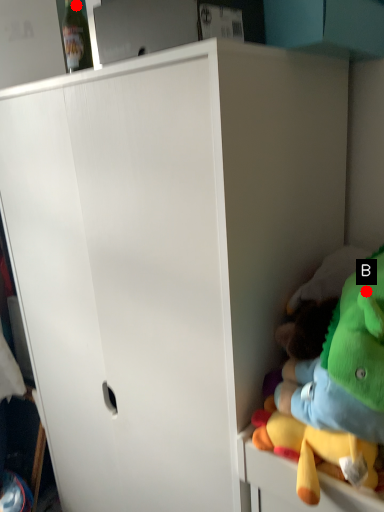
Question: Two points are circled on the image, labeled by A and B beside each circle. Which point is farther to the camera?

Choices:
 (A) A is further
 (B) B is further

Answer: (A)